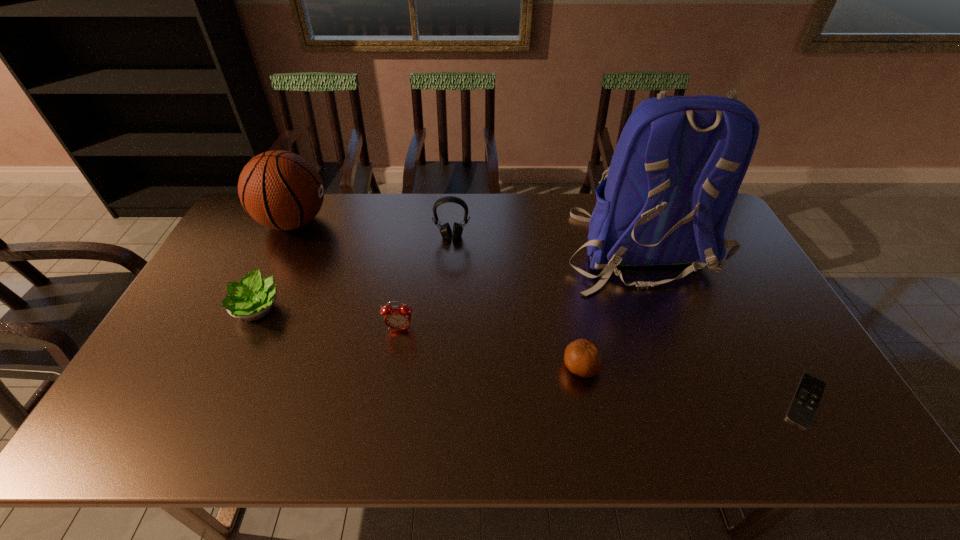
Identify the location of blank space at the right edge. The image size is (960, 540). (757, 335).

Locate an element on the screen. free space at the far left corner of the desktop is located at coordinates (243, 226).

In the image, there is a desktop. What are the coordinates of `vacant area at the near right corner` in the screenshot? It's located at (829, 443).

Where is `vacant area that lies between the clementine and the sixth shortest object`? The image size is (960, 540). vacant area that lies between the clementine and the sixth shortest object is located at coordinates (438, 295).

I want to click on vacant area that lies between the shortest object and the lettuce, so click(x=532, y=355).

Where is `free point between the lettuce and the backpack`? Image resolution: width=960 pixels, height=540 pixels. free point between the lettuce and the backpack is located at coordinates (447, 279).

You are a GUI agent. You are given a task and a screenshot of the screen. Output one action in this format:
    pyautogui.click(x=<x>, y=<y>)
    Task: Click on the empty space between the lettuce and the shortest object
    
    Given the screenshot: What is the action you would take?
    pyautogui.click(x=532, y=355)

Image resolution: width=960 pixels, height=540 pixels. What are the coordinates of `free point between the sixth shortest object and the tallest object` in the screenshot? It's located at (466, 235).

Where is `unoccupied area between the shortest object and the fifth shortest object`? The width and height of the screenshot is (960, 540). unoccupied area between the shortest object and the fifth shortest object is located at coordinates [x=629, y=319].

Find the location of a particular element. This screenshot has width=960, height=540. empty location between the clementine and the backpack is located at coordinates (610, 308).